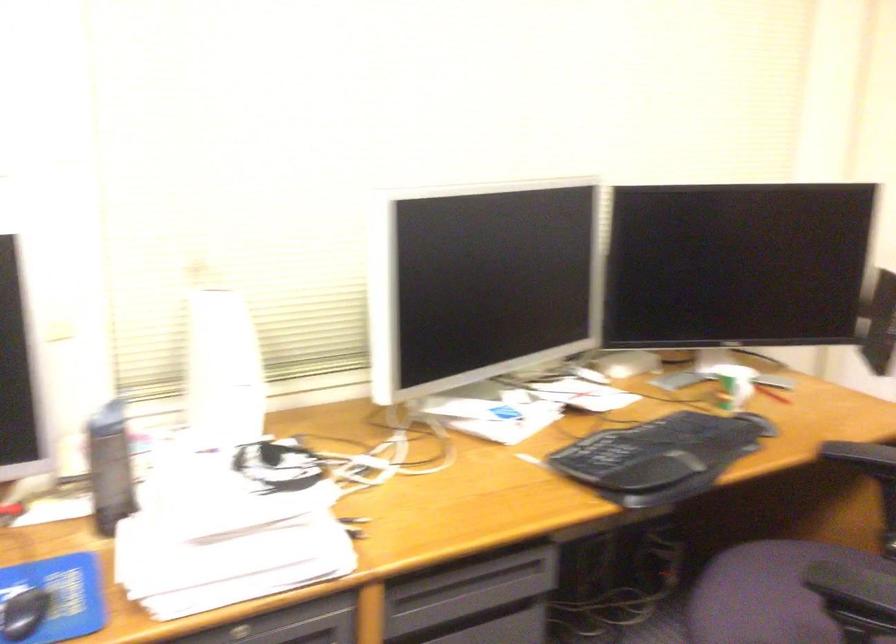
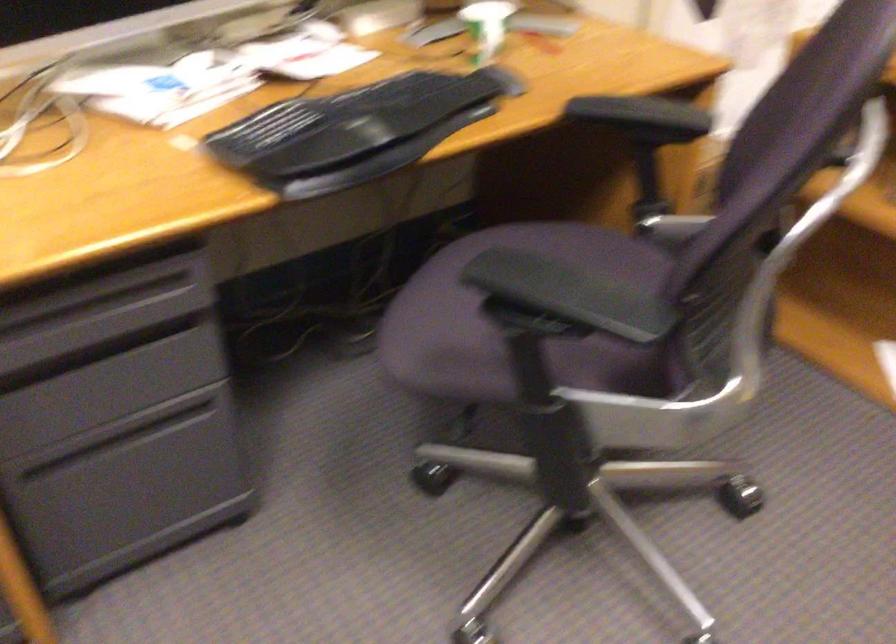
Question: Based on the continuous images, in which direction is the camera rotating? Reply with the corresponding letter.

Choices:
 (A) Left
 (B) Right
 (C) Up
 (D) Down

Answer: (D)